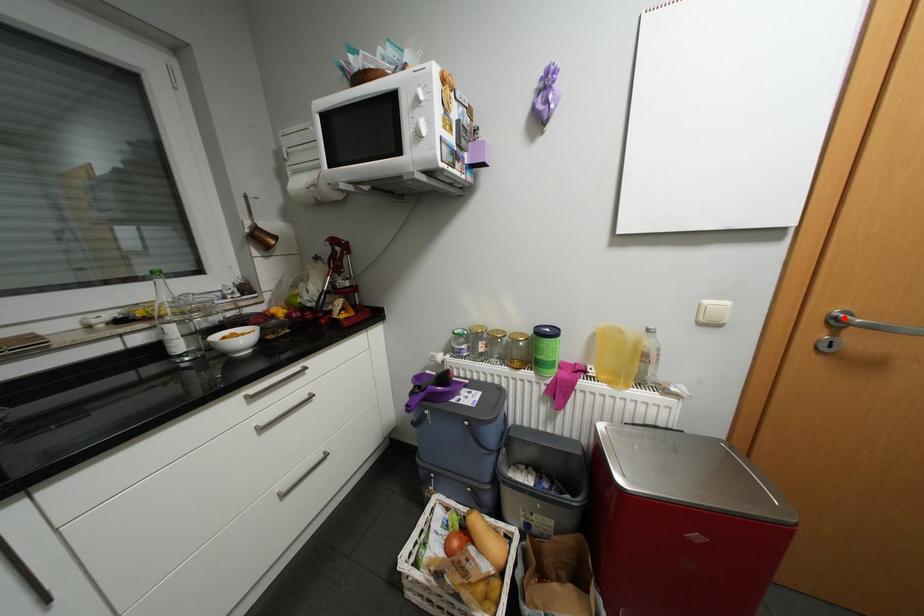
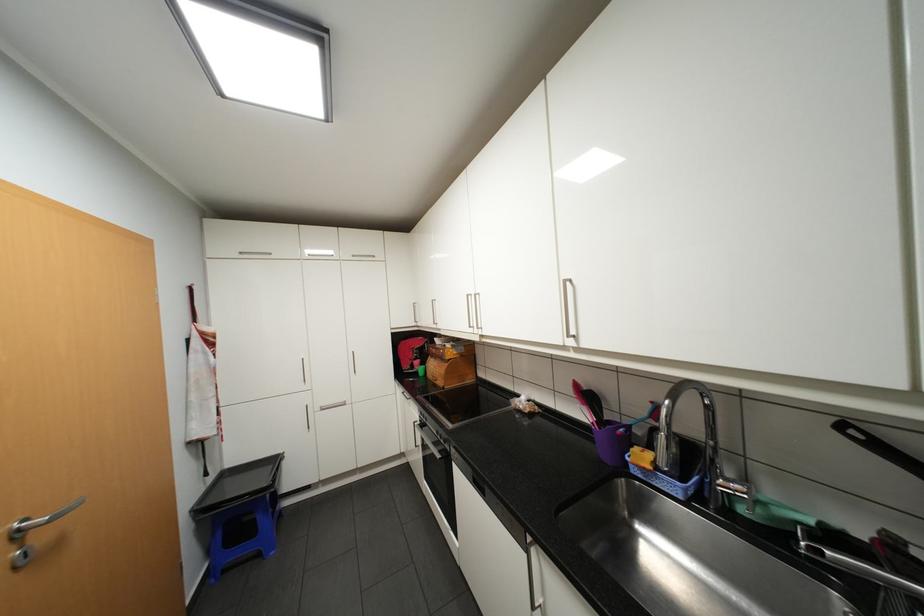
In the second image, find the point that corresponds to the highlighted location in the first image.

(27, 530)